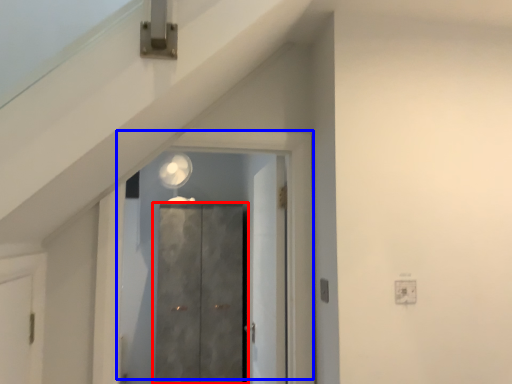
Question: Among these objects, which one is farthest to the camera, door (highlighted by a red box) or door (highlighted by a blue box)?

Choices:
 (A) door
 (B) door

Answer: (A)